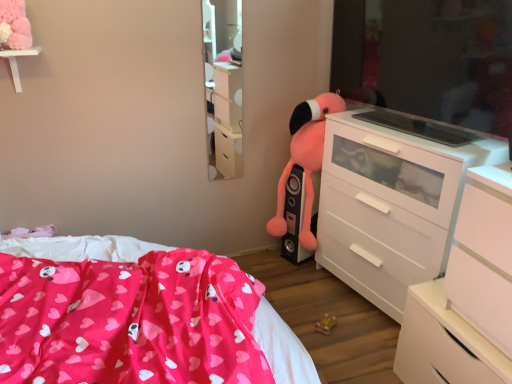
This screenshot has width=512, height=384. In order to click on white matte chest of drawers at right, the 3th chest of drawers in the back-to-front sequence in this screenshot , I will do `click(466, 295)`.

In order to face light wood mirror at upper center, should I rotate leftwards or rightwards?

To align with it, rotate left about 4.152°.

Measure the distance between pink fabric bed at lower left and camera.

pink fabric bed at lower left and camera are 5.64 feet apart.

Where is `white matte chest of drawers at right, the 3th chest of drawers in the back-to-front sequence`? white matte chest of drawers at right, the 3th chest of drawers in the back-to-front sequence is located at coordinates (466, 295).

Is light wood mirror at upper center aimed at white matte chest of drawers at right, the first chest of drawers viewed from the front?

No.

Is light wood mirror at upper center located outside white matte chest of drawers at right, the 3th chest of drawers in the back-to-front sequence?

light wood mirror at upper center is positioned outside white matte chest of drawers at right, the 3th chest of drawers in the back-to-front sequence.

What's the angular difference between light wood mirror at upper center and white matte chest of drawers at right, the first chest of drawers viewed from the front,'s facing directions?

The angle between the facing direction of light wood mirror at upper center and the facing direction of white matte chest of drawers at right, the first chest of drawers viewed from the front, is 91.2 degrees.

Looking at the image, does light wood mirror at upper center seem bigger or smaller compared to white matte chest of drawers at right, the first chest of drawers viewed from the front?

Clearly, light wood mirror at upper center is smaller in size than white matte chest of drawers at right, the first chest of drawers viewed from the front.

Is pink fabric bed at lower left at the back of white glossy chest of drawers at right, which is counted as the 3th chest of drawers, starting from the front?

white glossy chest of drawers at right, which is counted as the 3th chest of drawers, starting from the front, does not have its back to pink fabric bed at lower left.

Looking at this image, between white glossy chest of drawers at right, which is counted as the 3th chest of drawers, starting from the front, and pink fabric bed at lower left, which one has smaller size?

Smaller between the two is pink fabric bed at lower left.

What's the angular difference between white glossy chest of drawers at right, the 1th chest of drawers when ordered from back to front, and pink fabric bed at lower left's facing directions?

There is a 147-degree angle between the facing directions of white glossy chest of drawers at right, the 1th chest of drawers when ordered from back to front, and pink fabric bed at lower left.

From a real-world perspective, which object stands above the other?

pink fabric bed at lower left is physically above.

From a real-world perspective, which is physically below, fluffy pink stuffed animal at center-right or white glossy chest of drawers at lower right, acting as the 2th chest of drawers starting from the front?

From a 3D spatial view, white glossy chest of drawers at lower right, acting as the 2th chest of drawers starting from the front, is below.

In the scene shown: Are fluffy pink stuffed animal at center-right and white glossy chest of drawers at lower right, acting as the 2th chest of drawers starting from the front, far apart?

No, fluffy pink stuffed animal at center-right is not far from white glossy chest of drawers at lower right, acting as the 2th chest of drawers starting from the front.

The width and height of the screenshot is (512, 384). There is a fluffy pink stuffed animal at center-right. Find the location of `the 3rd chest of drawers below it (from the image's perspective)`. the 3rd chest of drawers below it (from the image's perspective) is located at coordinates (444, 343).

Looking at this image, is fluffy pink stuffed animal at center-right wider or thinner than white glossy chest of drawers at lower right, which is the 2th chest of drawers from back to front?

fluffy pink stuffed animal at center-right is thinner than white glossy chest of drawers at lower right, which is the 2th chest of drawers from back to front.

Does point (313, 167) come closer to viewer compared to point (234, 47)?

Yes.

From the image's perspective, is fluffy pink stuffed animal at center-right above or below light wood mirror at upper center?

From the image's perspective, fluffy pink stuffed animal at center-right appears below light wood mirror at upper center.

Is light wood mirror at upper center at the back of fluffy pink stuffed animal at center-right?

fluffy pink stuffed animal at center-right is not turned away from light wood mirror at upper center.

Which is behind, point (447, 321) or point (312, 149)?

Positioned behind is point (312, 149).

Is white matte chest of drawers at right, the first chest of drawers viewed from the front, taller than fluffy pink stuffed animal at center-right?

No, white matte chest of drawers at right, the first chest of drawers viewed from the front, is not taller than fluffy pink stuffed animal at center-right.

Does white matte chest of drawers at right, the first chest of drawers viewed from the front, come in front of fluffy pink stuffed animal at center-right?

Yes, it is.

Looking at their sizes, would you say white matte chest of drawers at right, the 3th chest of drawers in the back-to-front sequence, is wider or thinner than fluffy pink stuffed animal at center-right?

Clearly, white matte chest of drawers at right, the 3th chest of drawers in the back-to-front sequence, has more width compared to fluffy pink stuffed animal at center-right.

Is light wood mirror at upper center facing towards pink fabric bed at lower left?

No, light wood mirror at upper center is not facing towards pink fabric bed at lower left.

Are light wood mirror at upper center and pink fabric bed at lower left located far from each other?

That's right, there is a large distance between light wood mirror at upper center and pink fabric bed at lower left.

Can you confirm if light wood mirror at upper center is positioned to the left of pink fabric bed at lower left?

No.

From the image's perspective, relative to pink fabric bed at lower left, is light wood mirror at upper center above or below?

light wood mirror at upper center is above pink fabric bed at lower left.

From their relative heights in the image, would you say white matte chest of drawers at right, the first chest of drawers viewed from the front, is taller or shorter than pink fabric bed at lower left?

white matte chest of drawers at right, the first chest of drawers viewed from the front, is taller than pink fabric bed at lower left.

Could you tell me if white matte chest of drawers at right, the 3th chest of drawers in the back-to-front sequence, is facing pink fabric bed at lower left?

Yes, white matte chest of drawers at right, the 3th chest of drawers in the back-to-front sequence, is turned towards pink fabric bed at lower left.

Between white matte chest of drawers at right, the 3th chest of drawers in the back-to-front sequence, and pink fabric bed at lower left, which one appears on the left side from the viewer's perspective?

pink fabric bed at lower left is more to the left.

Find the location of a particular element. mirror located above the white matte chest of drawers at right, the 3th chest of drawers in the back-to-front sequence (from the image's perspective) is located at coordinates [x=223, y=87].

Locate an element on the screen. The width and height of the screenshot is (512, 384). bed below the white glossy chest of drawers at right, the 1th chest of drawers when ordered from back to front (from the image's perspective) is located at coordinates (81, 247).

Which object lies nearer to the anchor point white glossy chest of drawers at lower right, which is the 2th chest of drawers from back to front, pink fabric bed at lower left or white matte chest of drawers at right, the first chest of drawers viewed from the front?

The object closer to white glossy chest of drawers at lower right, which is the 2th chest of drawers from back to front, is white matte chest of drawers at right, the first chest of drawers viewed from the front.

Which object lies further to the anchor point pink fabric bed at lower left, white glossy chest of drawers at lower right, acting as the 2th chest of drawers starting from the front, or fluffy pink stuffed animal at center-right?

Among the two, white glossy chest of drawers at lower right, acting as the 2th chest of drawers starting from the front, is located further to pink fabric bed at lower left.

In the scene shown: Considering their positions, is white matte chest of drawers at right, the first chest of drawers viewed from the front, positioned further to fluffy pink stuffed animal at center-right than light wood mirror at upper center?

white matte chest of drawers at right, the first chest of drawers viewed from the front.

Estimate the real-world distances between objects in this image. Which object is closer to white matte chest of drawers at right, the first chest of drawers viewed from the front, white glossy chest of drawers at lower right, which is the 2th chest of drawers from back to front, or fluffy pink stuffed animal at center-right?

white glossy chest of drawers at lower right, which is the 2th chest of drawers from back to front, lies closer to white matte chest of drawers at right, the first chest of drawers viewed from the front, than the other object.

Looking at the image, which one is located closer to white glossy chest of drawers at right, the 1th chest of drawers when ordered from back to front, fluffy pink stuffed animal at center-right or light wood mirror at upper center?

The object closer to white glossy chest of drawers at right, the 1th chest of drawers when ordered from back to front, is fluffy pink stuffed animal at center-right.

Estimate the real-world distances between objects in this image. Which object is closer to fluffy pink stuffed animal at center-right, light wood mirror at upper center or white glossy chest of drawers at right, the 1th chest of drawers when ordered from back to front?

The object closer to fluffy pink stuffed animal at center-right is white glossy chest of drawers at right, the 1th chest of drawers when ordered from back to front.

Based on the photo, which object lies further to the anchor point white glossy chest of drawers at lower right, acting as the 2th chest of drawers starting from the front, pink fabric bed at lower left or fluffy pink stuffed animal at center-right?

Based on the image, pink fabric bed at lower left appears to be further to white glossy chest of drawers at lower right, acting as the 2th chest of drawers starting from the front.

Based on their spatial positions, is white glossy chest of drawers at right, which is counted as the 3th chest of drawers, starting from the front, or white matte chest of drawers at right, the first chest of drawers viewed from the front, closer to pink fabric bed at lower left?

white glossy chest of drawers at right, which is counted as the 3th chest of drawers, starting from the front.

You are a GUI agent. You are given a task and a screenshot of the screen. Output one action in this format:
    pyautogui.click(x=<x>, y=<y>)
    Task: Click on the mirror between pink fabric bed at lower left and white matte chest of drawers at right, the 3th chest of drawers in the back-to-front sequence, from left to right
    
    Given the screenshot: What is the action you would take?
    pyautogui.click(x=223, y=87)

The height and width of the screenshot is (384, 512). Find the location of `mirror located between pink fabric bed at lower left and white glossy chest of drawers at lower right, acting as the 2th chest of drawers starting from the front, in the left-right direction`. mirror located between pink fabric bed at lower left and white glossy chest of drawers at lower right, acting as the 2th chest of drawers starting from the front, in the left-right direction is located at coordinates (223, 87).

The image size is (512, 384). Find the location of `chest of drawers between white glossy chest of drawers at right, the 1th chest of drawers when ordered from back to front, and white glossy chest of drawers at lower right, which is the 2th chest of drawers from back to front, from top to bottom`. chest of drawers between white glossy chest of drawers at right, the 1th chest of drawers when ordered from back to front, and white glossy chest of drawers at lower right, which is the 2th chest of drawers from back to front, from top to bottom is located at coordinates (466, 295).

This screenshot has width=512, height=384. What are the coordinates of `animal between light wood mirror at upper center and white glossy chest of drawers at right, which is counted as the 3th chest of drawers, starting from the front, from left to right` in the screenshot? It's located at (305, 160).